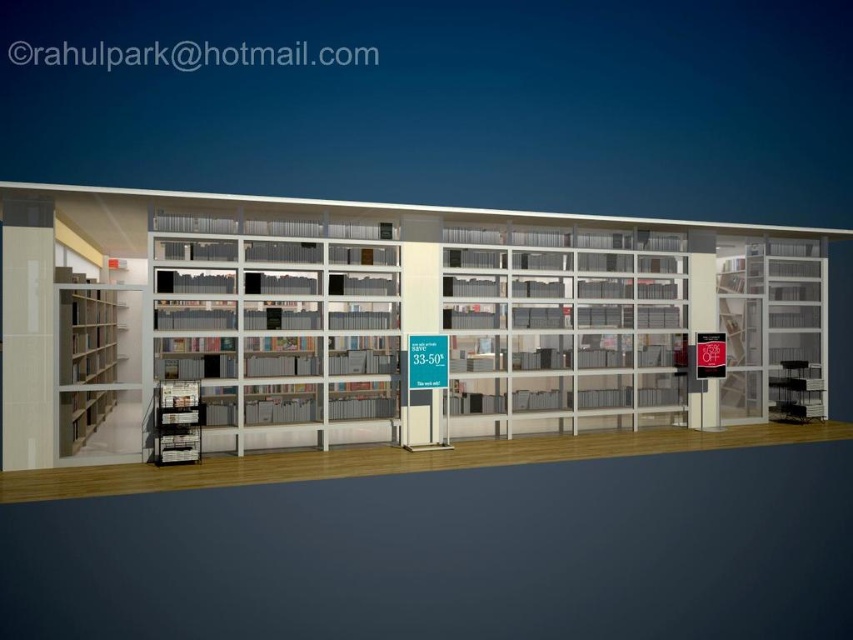
Question: Which point is farther to the camera?

Choices:
 (A) clear glass bookcase at center
 (B) white glossy bookcase at center

Answer: (A)

Question: Among these points, which one is nearest to the camera?

Choices:
 (A) (718, 292)
 (B) (64, 268)

Answer: (B)

Question: Estimate the real-world distances between objects in this image. Which object is farther from the white glossy bookcase at center?

Choices:
 (A) clear glass shelves at right
 (B) wooden bookshelf at left

Answer: (B)

Question: Does clear glass bookcase at center have a smaller size compared to wooden bookshelf at left?

Choices:
 (A) yes
 (B) no

Answer: (B)

Question: Does white glossy bookcase at center have a greater width compared to wooden bookshelf at left?

Choices:
 (A) no
 (B) yes

Answer: (B)

Question: Is white glossy bookcase at center further to the viewer compared to wooden bookshelf at left?

Choices:
 (A) yes
 (B) no

Answer: (B)